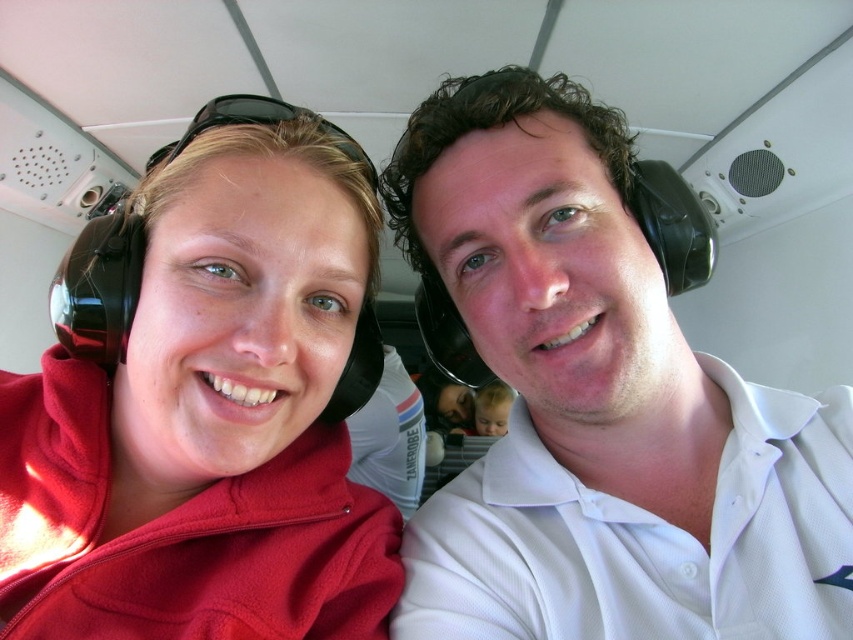
Does matte fleece jacket at left have a greater width compared to smooth skin baby at center?

Yes, matte fleece jacket at left is wider than smooth skin baby at center.

Is matte fleece jacket at left below smooth skin baby at center?

Actually, matte fleece jacket at left is above smooth skin baby at center.

Find the location of a particular element. Image resolution: width=853 pixels, height=640 pixels. matte fleece jacket at left is located at coordinates (209, 419).

Can you confirm if white matte shirt at center is positioned above matte fleece jacket at left?

Yes.

Who is more distant from viewer, [572,595] or [97,378]?

Positioned behind is point [97,378].

In order to click on white matte shirt at center in this screenshot , I will do `click(596, 403)`.

Identify the location of white matte shirt at center. The width and height of the screenshot is (853, 640). (596, 403).

Is white matte shirt at center shorter than smooth skin baby at center?

In fact, white matte shirt at center may be taller than smooth skin baby at center.

Between point (691, 452) and point (498, 428), which one is positioned behind?

Positioned behind is point (498, 428).

Where is `white matte shirt at center`? This screenshot has height=640, width=853. white matte shirt at center is located at coordinates (596, 403).